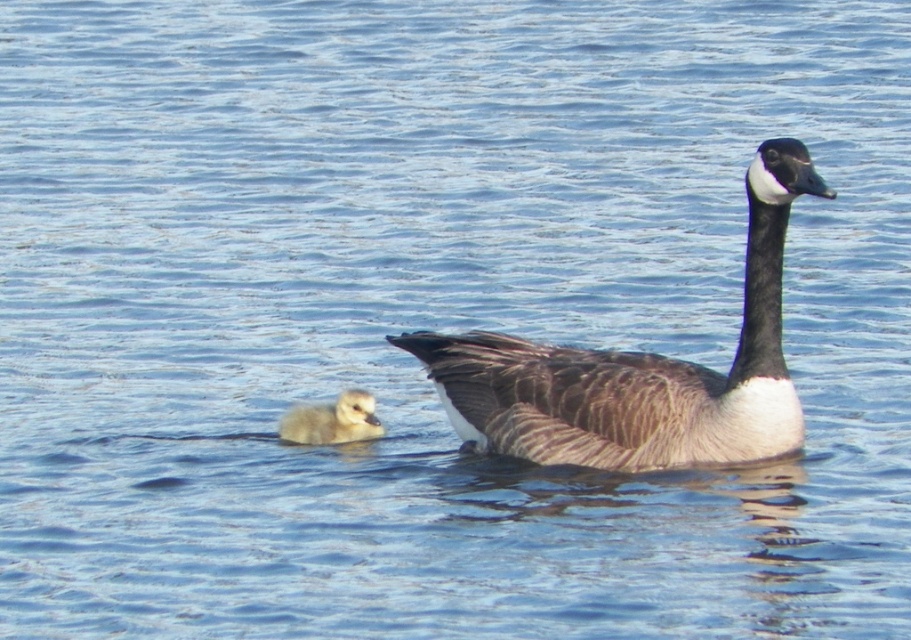
From the picture: Between brown textured goose at center and light brown downy gosling at lower left, which one is positioned lower?

light brown downy gosling at lower left is below.

Which is more to the right, brown textured goose at center or light brown downy gosling at lower left?

From the viewer's perspective, brown textured goose at center appears more on the right side.

Describe the element at coordinates (640, 369) in the screenshot. The width and height of the screenshot is (911, 640). I see `brown textured goose at center` at that location.

Locate an element on the screen. brown textured goose at center is located at coordinates (640, 369).